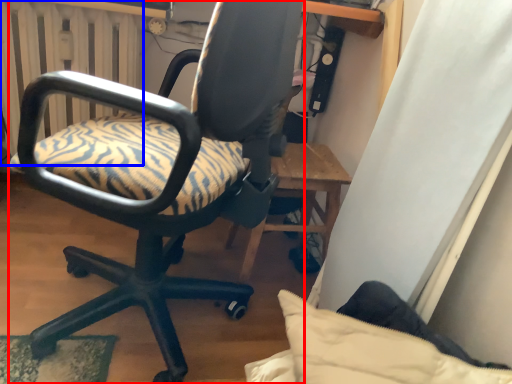
Question: Which object appears closest to the camera in this image, chair (highlighted by a red box) or radiator (highlighted by a blue box)?

Choices:
 (A) chair
 (B) radiator

Answer: (A)